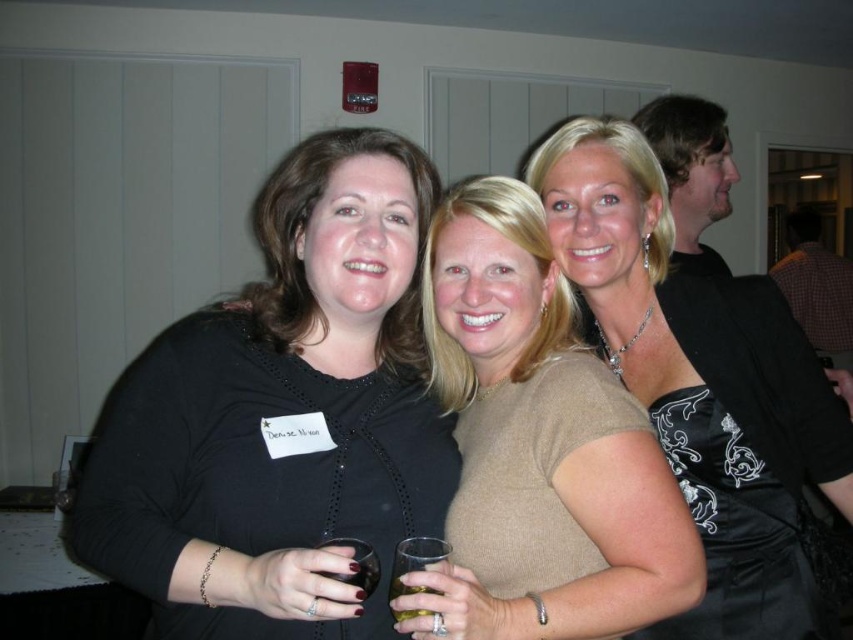
How distant is black matte dress at center from translucent glass at center?

10.64 inches

Can you confirm if black matte dress at center is positioned below translucent glass at center?

No.

Between point (418, 440) and point (404, 538), which one is positioned behind?

The point (418, 440) is more distant.

The height and width of the screenshot is (640, 853). I want to click on black matte dress at center, so click(282, 413).

Who is lower down, black matte dress at center or translucent glass at lower left?

Positioned lower is translucent glass at lower left.

Measure the distance between black matte dress at center and translucent glass at lower left.

black matte dress at center is 24.34 centimeters away from translucent glass at lower left.

The height and width of the screenshot is (640, 853). In order to click on black matte dress at center in this screenshot , I will do `click(282, 413)`.

Is point (637, 604) positioned before point (335, 577)?

No, it is behind (335, 577).

Who is more forward, (509,198) or (364,554)?

Point (364,554) is in front.

Identify the location of beige jersey top at center. The image size is (853, 640). (538, 445).